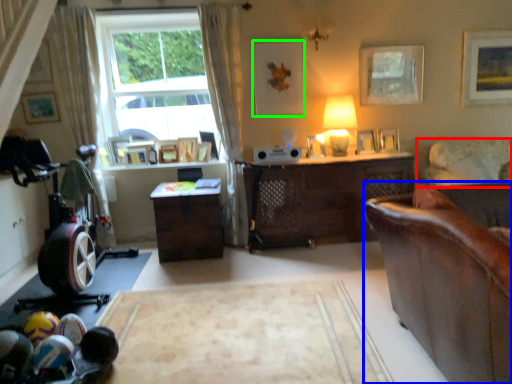
Question: Considering the real-world distances, which object is closest to studio couch (highlighted by a red box)? studio couch (highlighted by a blue box) or picture frame (highlighted by a green box).

Choices:
 (A) studio couch
 (B) picture frame

Answer: (B)